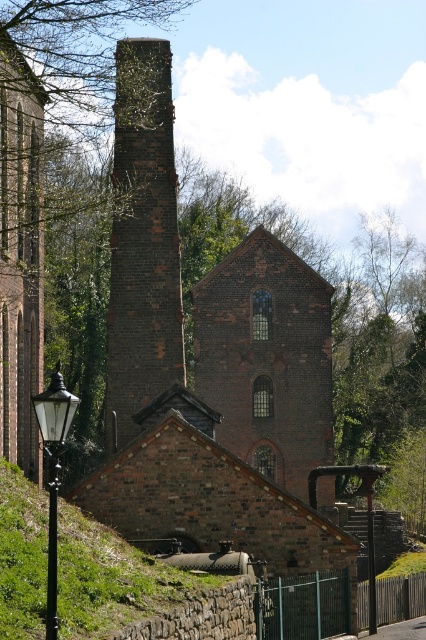
Does brown brick tower at left have a greater width compared to black glass lamp post at lower left?

No.

The width and height of the screenshot is (426, 640). In order to click on brown brick tower at left in this screenshot , I will do `click(20, 256)`.

Between green grassy hillside at lower left and black glass lamp post at lower left, which one appears on the right side from the viewer's perspective?

green grassy hillside at lower left is more to the right.

Is point (126, 595) behind point (57, 429)?

Yes, it is behind point (57, 429).

Is point (31, 625) positioned after point (57, 420)?

Yes, it is behind point (57, 420).

This screenshot has width=426, height=640. What are the coordinates of `green grassy hillside at lower left` in the screenshot? It's located at (112, 579).

Who is lower down, dark brown brick chimney at center or black glass lamp post at lower left?

black glass lamp post at lower left

Can you confirm if dark brown brick chimney at center is wider than black glass lamp post at lower left?

No, dark brown brick chimney at center is not wider than black glass lamp post at lower left.

What do you see at coordinates (143, 241) in the screenshot?
I see `dark brown brick chimney at center` at bounding box center [143, 241].

Locate an element on the screen. The width and height of the screenshot is (426, 640). dark brown brick chimney at center is located at coordinates (143, 241).